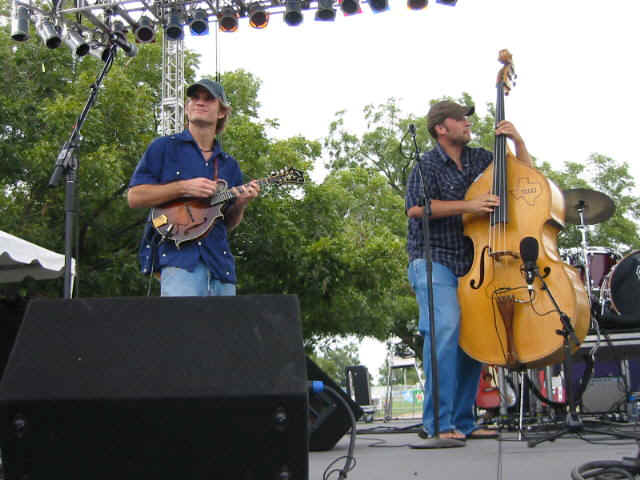
You are a GUI agent. You are given a task and a screenshot of the screen. Output one action in this format:
    pyautogui.click(x=<x>, y=<y>)
    Task: Click on the cords
    
    Given the screenshot: What is the action you would take?
    pyautogui.click(x=348, y=450), pyautogui.click(x=372, y=426), pyautogui.click(x=617, y=464), pyautogui.click(x=598, y=426)